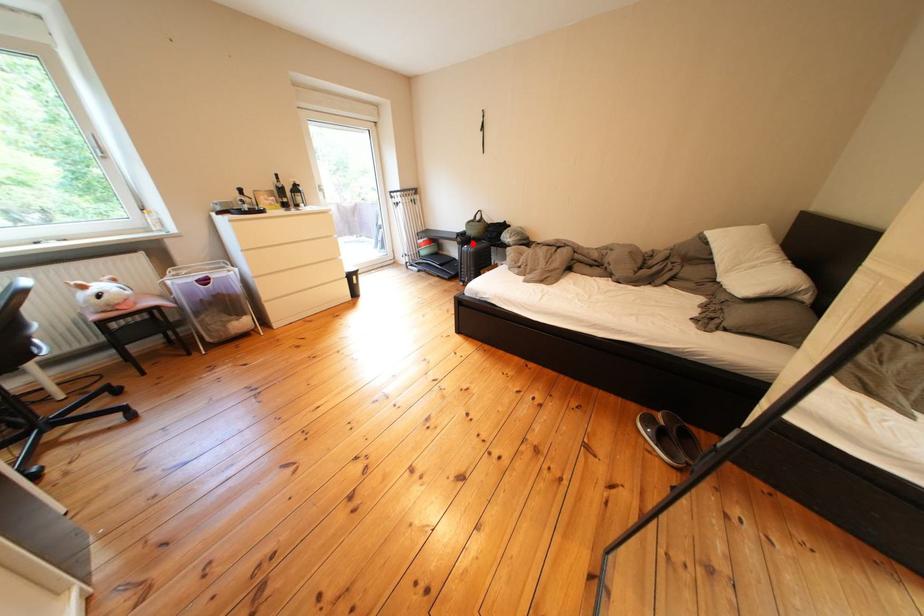
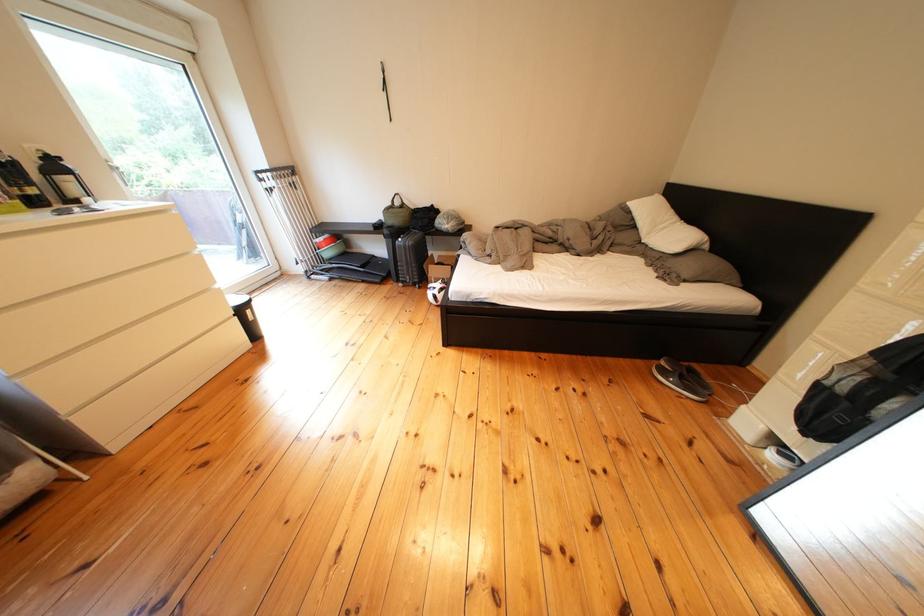
Question: I am providing you with two images of the same scene from different viewpoints. A red point is shown in image1. For the corresponding object point in image2, is it positioned nearer or farther from the camera?

Choices:
 (A) Nearer
 (B) Farther

Answer: (B)